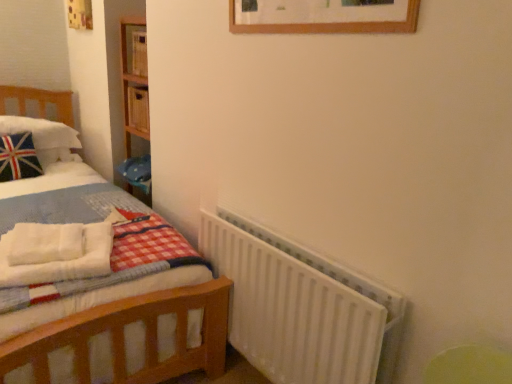
The width and height of the screenshot is (512, 384). What do you see at coordinates (45, 138) in the screenshot? I see `white plush pillow at left` at bounding box center [45, 138].

The image size is (512, 384). I want to click on white plush pillow at left, so click(x=45, y=138).

The width and height of the screenshot is (512, 384). Identify the location of white fluffy blanket at left. (54, 253).

Looking at this image, in the image, is white plush pillow at left on the left side or the right side of white matte radiator at lower right?

In the image, white plush pillow at left appears on the left side of white matte radiator at lower right.

Is the surface of white plush pillow at left in direct contact with white matte radiator at lower right?

white plush pillow at left and white matte radiator at lower right are not in contact.

Consider the image. Is the depth of white plush pillow at left greater than that of white matte radiator at lower right?

Yes, white plush pillow at left is behind white matte radiator at lower right.

Locate an element on the screen. The image size is (512, 384). radiator located underneath the white fluffy blanket at left (from a real-world perspective) is located at coordinates (301, 308).

Considering the relative sizes of white matte radiator at lower right and white fluffy blanket at left in the image provided, is white matte radiator at lower right shorter than white fluffy blanket at left?

Incorrect, the height of white matte radiator at lower right does not fall short of that of white fluffy blanket at left.

Considering the points (272, 308) and (93, 233), which point is behind, point (272, 308) or point (93, 233)?

The point (93, 233) is farther.

Would you say white fluffy blanket at left is a long distance from white matte radiator at lower right?

No, there isn't a large distance between white fluffy blanket at left and white matte radiator at lower right.

From the picture: From the image's perspective, which is below, white fluffy blanket at left or white matte radiator at lower right?

white matte radiator at lower right is shown below in the image.

Measure the distance from white fluffy blanket at left to white matte radiator at lower right.

A distance of 24.41 inches exists between white fluffy blanket at left and white matte radiator at lower right.

Can you confirm if white fluffy blanket at left is taller than white matte radiator at lower right?

In fact, white fluffy blanket at left may be shorter than white matte radiator at lower right.

Is white fluffy blanket at left placed right next to white plush pillow at left?

white fluffy blanket at left and white plush pillow at left are clearly separated.

What's the angular difference between white fluffy blanket at left and white plush pillow at left's facing directions?

There is a 20.3-degree angle between the facing directions of white fluffy blanket at left and white plush pillow at left.

Which of these two, white fluffy blanket at left or white plush pillow at left, is thinner?

With smaller width is white fluffy blanket at left.

In the scene shown: Which object is wider, white matte radiator at lower right or white plush pillow at left?

Wider between the two is white plush pillow at left.

Considering the relative positions of white matte radiator at lower right and white plush pillow at left in the image provided, is white matte radiator at lower right to the right of white plush pillow at left from the viewer's perspective?

Correct, you'll find white matte radiator at lower right to the right of white plush pillow at left.

This screenshot has height=384, width=512. I want to click on radiator on the right of white plush pillow at left, so click(x=301, y=308).

From a real-world perspective, who is located lower, white matte radiator at lower right or white plush pillow at left?

From a 3D spatial view, white matte radiator at lower right is below.

Can you confirm if white plush pillow at left is wider than white fluffy blanket at left?

Correct, the width of white plush pillow at left exceeds that of white fluffy blanket at left.

Could you tell me if white plush pillow at left is turned towards white fluffy blanket at left?

Yes, white plush pillow at left is facing white fluffy blanket at left.

From a real-world perspective, is white plush pillow at left physically below white fluffy blanket at left?

No, from a real-world perspective, white plush pillow at left is not beneath white fluffy blanket at left.

Is white plush pillow at left not within white fluffy blanket at left?

white plush pillow at left is positioned outside white fluffy blanket at left.

The height and width of the screenshot is (384, 512). Find the location of `radiator below the white plush pillow at left (from the image's perspective)`. radiator below the white plush pillow at left (from the image's perspective) is located at coordinates (301, 308).

Image resolution: width=512 pixels, height=384 pixels. Find the location of `blanket above the white matte radiator at lower right (from the image's perspective)`. blanket above the white matte radiator at lower right (from the image's perspective) is located at coordinates (54, 253).

From the image, which object appears to be nearer to white matte radiator at lower right, white plush pillow at left or white fluffy blanket at left?

white fluffy blanket at left is closer to white matte radiator at lower right.

Which object lies nearer to the anchor point white fluffy blanket at left, white matte radiator at lower right or white plush pillow at left?

white matte radiator at lower right.

Based on their spatial positions, is white fluffy blanket at left or white plush pillow at left further from white matte radiator at lower right?

white plush pillow at left is further to white matte radiator at lower right.

When comparing their distances from white plush pillow at left, does white fluffy blanket at left or white matte radiator at lower right seem further?

white matte radiator at lower right lies further to white plush pillow at left than the other object.

Which object lies nearer to the anchor point white fluffy blanket at left, white plush pillow at left or white matte radiator at lower right?

The object closer to white fluffy blanket at left is white matte radiator at lower right.

Estimate the real-world distances between objects in this image. Which object is closer to white plush pillow at left, white matte radiator at lower right or white fluffy blanket at left?

Among the two, white fluffy blanket at left is located nearer to white plush pillow at left.

You are a GUI agent. You are given a task and a screenshot of the screen. Output one action in this format:
    pyautogui.click(x=<x>, y=<y>)
    Task: Click on the blanket between white plush pillow at left and white matte radiator at lower right
    This screenshot has height=384, width=512.
    Given the screenshot: What is the action you would take?
    pyautogui.click(x=54, y=253)